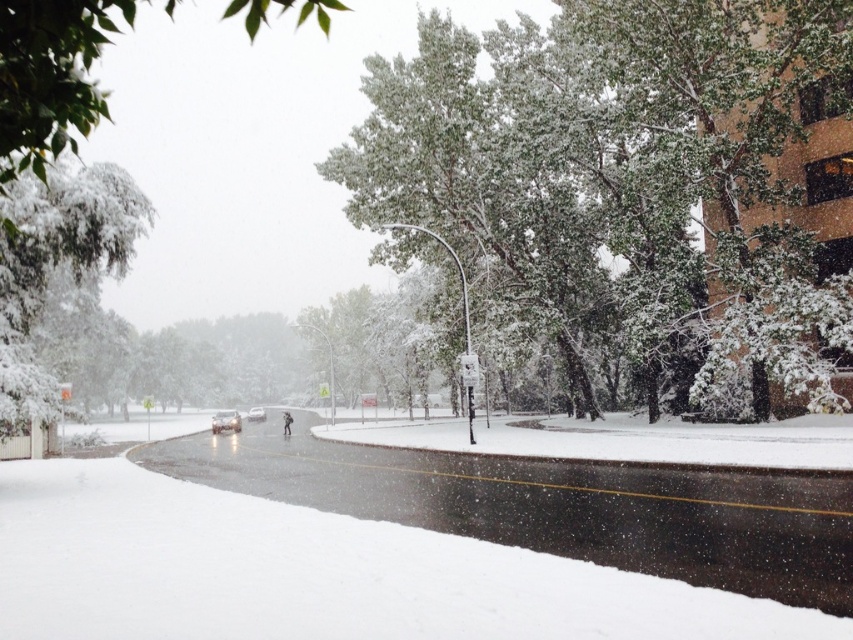
Question: Among these objects, which one is nearest to the camera?

Choices:
 (A) shiny silver sedan at center
 (B) glossy metallic car at center
 (C) snow-covered tree at center

Answer: (C)

Question: Can you confirm if snow-covered tree at center is wider than glossy metallic car at center?

Choices:
 (A) yes
 (B) no

Answer: (A)

Question: Can you confirm if white fluffy snow at center is positioned below glossy metallic car at center?

Choices:
 (A) no
 (B) yes

Answer: (A)

Question: Which of the following is the farthest from the observer?

Choices:
 (A) snow-covered tree at center
 (B) white snow-covered tree at left
 (C) shiny silver sedan at center

Answer: (C)

Question: Observing the image, what is the correct spatial positioning of white fluffy snow at center in reference to green leafy tree at upper left?

Choices:
 (A) below
 (B) above

Answer: (A)

Question: Based on their relative distances, which object is farther from the green leafy tree at upper left?

Choices:
 (A) white fluffy snow at center
 (B) snow-covered tree at center

Answer: (A)